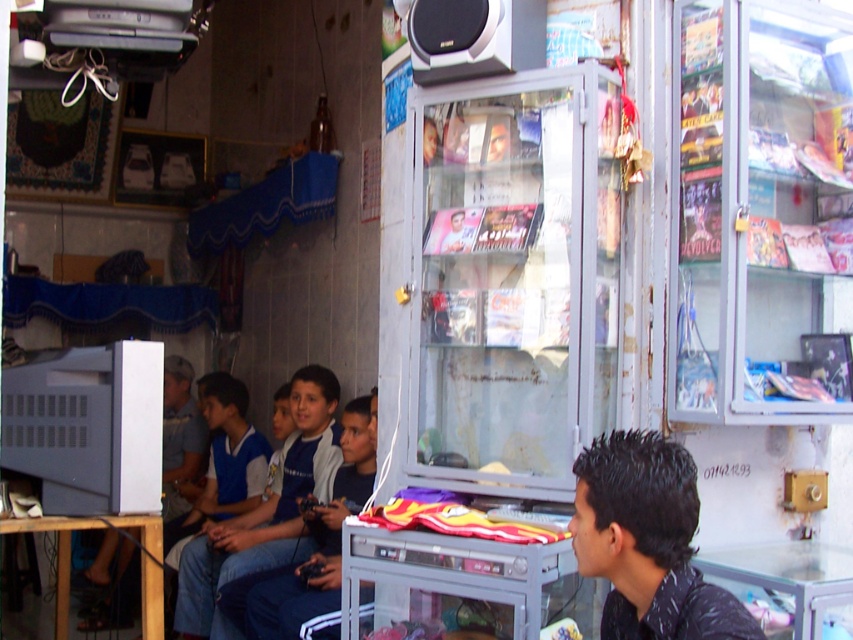
Question: Is blue jersey at center smaller than dark blue jeans at center?

Choices:
 (A) no
 (B) yes

Answer: (A)

Question: Among these objects, which one is farthest from the camera?

Choices:
 (A) black matte hair at center
 (B) dark blue jeans at center
 (C) blue jersey at center

Answer: (C)

Question: Is blue jersey at center thinner than matte black speaker at upper center?

Choices:
 (A) no
 (B) yes

Answer: (A)

Question: Which is farther from the matte black speaker at upper center?

Choices:
 (A) blue jersey at center
 (B) dark blue jeans at center
 (C) black matte hair at center

Answer: (A)

Question: Which point appears farthest from the camera in this image?

Choices:
 (A) (463, 76)
 (B) (293, 541)

Answer: (B)

Question: Is blue jersey at center positioned in front of matte black speaker at upper center?

Choices:
 (A) no
 (B) yes

Answer: (A)